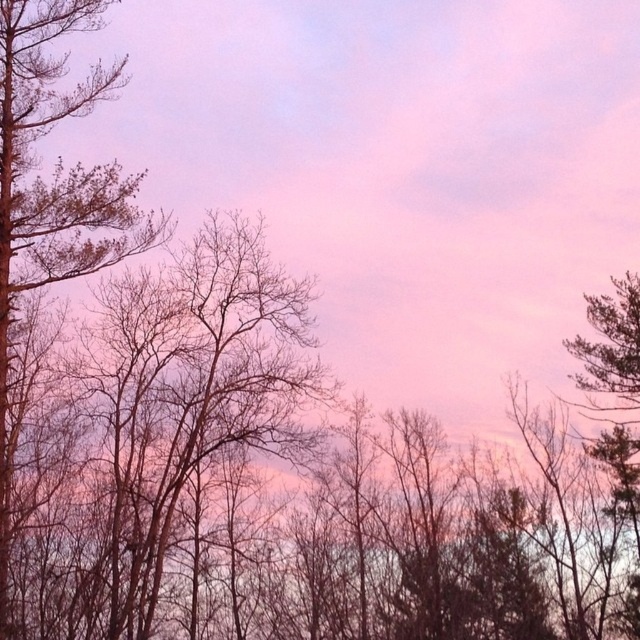
You are an artist planning to paint the scene. You want to ensure the bare branches at left and dark green textured tree at right are proportionally accurate. Which object should you paint shorter?

The bare branches at left should be painted shorter because it is not as tall as the dark green textured tree at right.

You are an artist planning to paint the scene. You want to ensure the bare branches at left and the dark green textured tree at right are proportionally accurate. Which object should you paint first to maintain scale, and why?

You should paint the dark green textured tree at right first because it is larger than the bare branches at left, ensuring proper scaling when adding the smaller branches afterward.

You are an artist sketching the scene and want to emphasize the contrast between the bare branches at left and the dark green textured tree at right. Which object should you draw with finer lines to highlight their thickness difference?

The bare branches at left should be drawn with finer lines since they are thinner than the dark green textured tree at right.